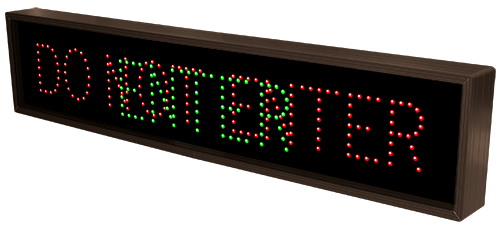
What are the coordinates of `red lights (circles)` in the screenshot? It's located at (109, 80).